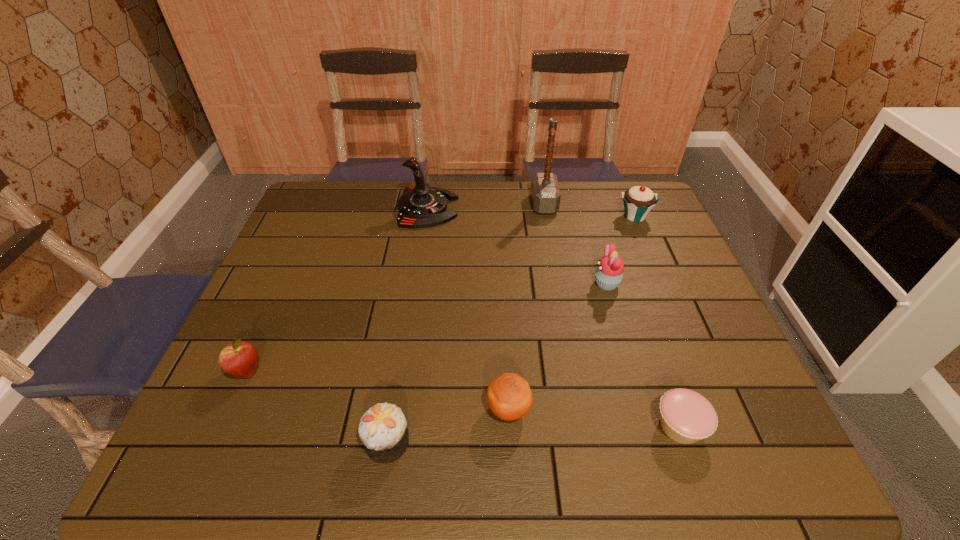
Identify the location of vacant space that satisfies the following two spatial constraints: 1. on the striking surface of the tallest object; 2. on the left side of the farthest cupcake. (546, 217).